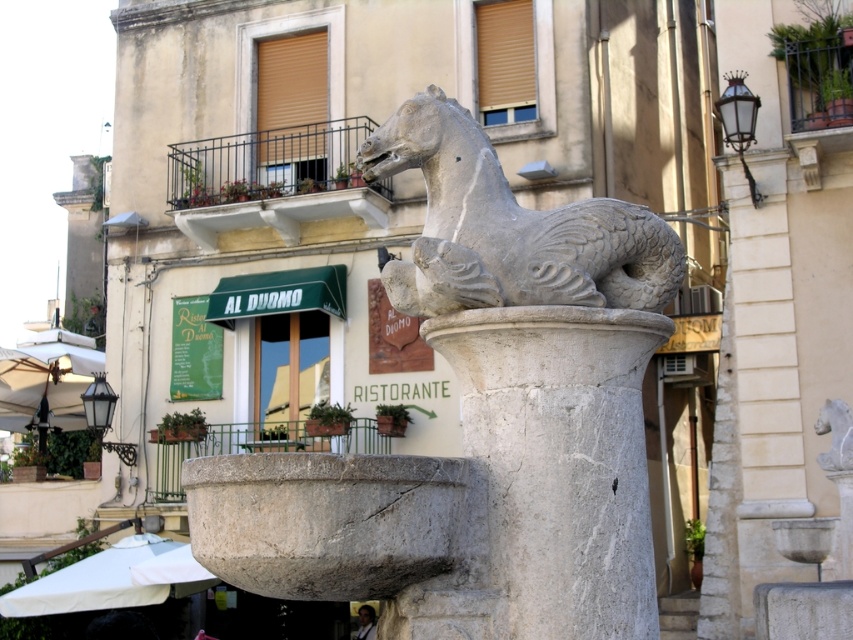
You are standing in the town square and want to locate the exact spot where the horse sculpture is positioned. According to the image, where is the point at coordinates (479, 420) located?

The point at coordinates (479, 420) is located on the white marble horse at center.

You are a photographer capturing the fountain and the building in the background. You notice two points in your viewfinder labeled as point (500, 264) and point (468, 188). Which point is closer to your camera lens?

Point (500, 264) is closer to the camera lens than point (468, 188).

You are standing in the town square and see the white marble horse at center and the white marble pillar at center. Which object is positioned to the right side from your perspective?

The white marble horse at center is to the right of the white marble pillar at center, so the white marble horse at center is positioned to the right side.